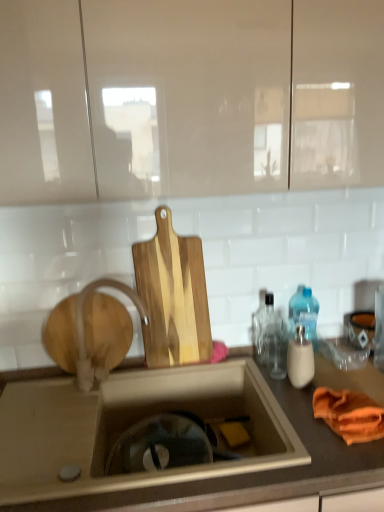
Where is `blank space to the left of white matte faucet at center`? The width and height of the screenshot is (384, 512). blank space to the left of white matte faucet at center is located at coordinates (56, 400).